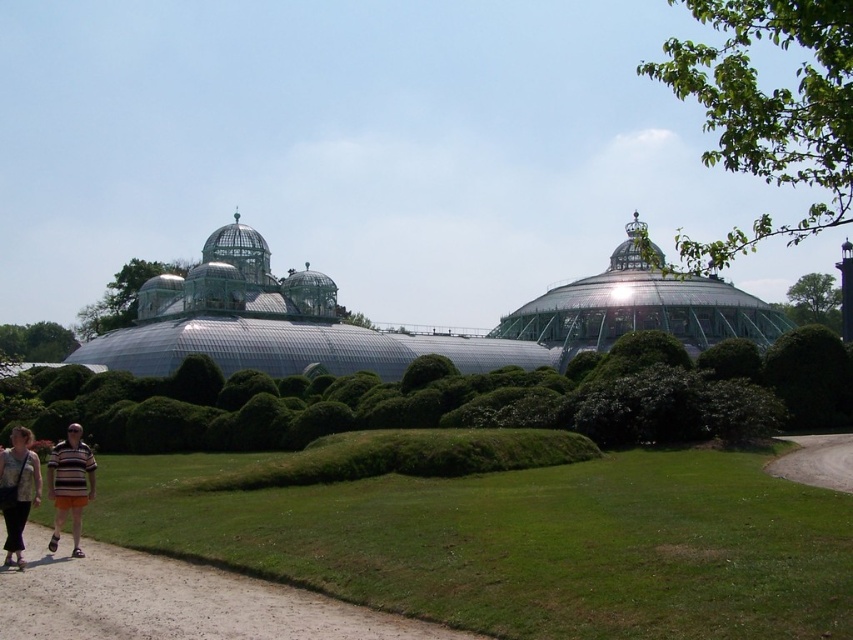
Can you confirm if green leafy bush at center is positioned below denim pants at lower left?

Incorrect, green leafy bush at center is not positioned below denim pants at lower left.

From the picture: Is green leafy bush at center wider than denim pants at lower left?

Yes, green leafy bush at center is wider than denim pants at lower left.

In order to click on green leafy bush at center in this screenshot , I will do `click(456, 397)`.

Can you confirm if transparent glass conservatory at center is taller than striped shirt at lower left?

Yes.

Which is more to the left, transparent glass conservatory at center or striped shirt at lower left?

striped shirt at lower left

The width and height of the screenshot is (853, 640). Describe the element at coordinates (402, 328) in the screenshot. I see `transparent glass conservatory at center` at that location.

The width and height of the screenshot is (853, 640). I want to click on transparent glass conservatory at center, so click(x=402, y=328).

In the scene shown: Does transparent glass conservatory at center appear on the right side of denim pants at lower left?

Indeed, transparent glass conservatory at center is positioned on the right side of denim pants at lower left.

From the picture: Is transparent glass conservatory at center smaller than denim pants at lower left?

Incorrect, transparent glass conservatory at center is not smaller in size than denim pants at lower left.

Which is in front, point (309, 320) or point (4, 481)?

Positioned in front is point (4, 481).

Image resolution: width=853 pixels, height=640 pixels. I want to click on transparent glass conservatory at center, so click(402, 328).